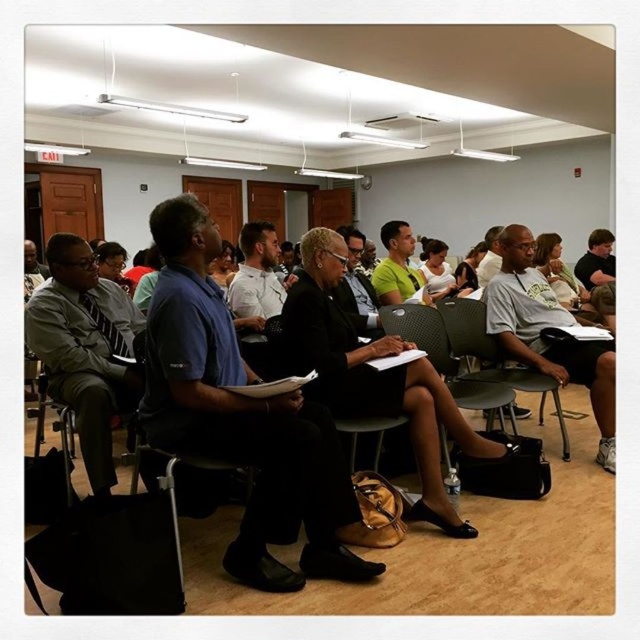
You are organizing a photo shoot and need to arrange two individuals based on their clothing sizes. The matte gray suit at left and the white cotton shirt at center are part of the shoot. Which clothing item should be placed on the left side of the frame to maintain visual balance?

The matte gray suit at left should be placed on the left side of the frame because its width is larger than the white cotton shirt at center, creating a balanced composition.

Where is the matte gray suit at left located in the image?

The matte gray suit at left is located at point coordinates of (84, 348).